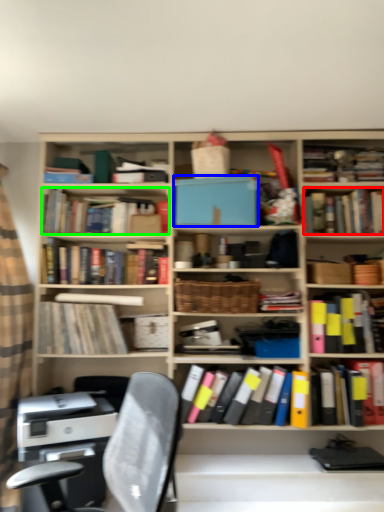
Question: Which is nearer to the book (highlighted by a red box)? paperback book (highlighted by a blue box) or book (highlighted by a green box).

Choices:
 (A) paperback book
 (B) book

Answer: (A)